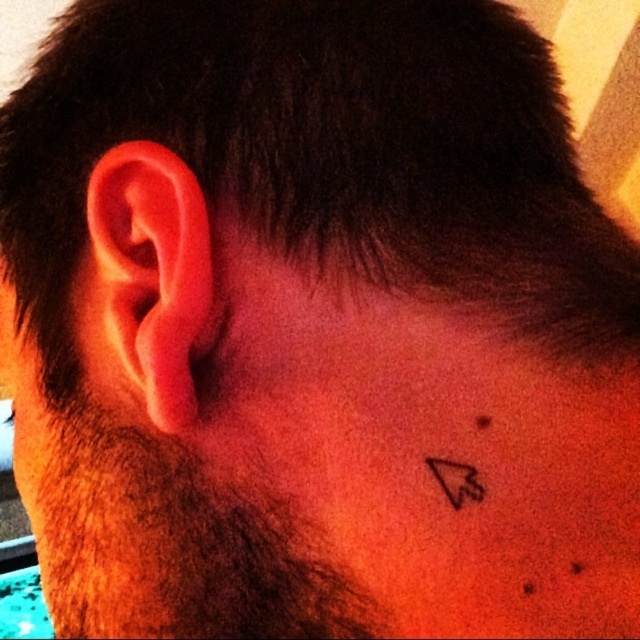
Question: Is pink flesh-colored ear at left smaller than black ink tattoo at lower center?

Choices:
 (A) no
 (B) yes

Answer: (A)

Question: Is pink flesh-colored ear at left thinner than black ink tattoo at lower center?

Choices:
 (A) no
 (B) yes

Answer: (A)

Question: Can you confirm if pink flesh-colored ear at left is thinner than black ink tattoo at lower center?

Choices:
 (A) no
 (B) yes

Answer: (A)

Question: Among these objects, which one is nearest to the camera?

Choices:
 (A) black ink tattoo at lower center
 (B) pink flesh-colored ear at left

Answer: (A)

Question: Which object is closer to the camera taking this photo?

Choices:
 (A) pink flesh-colored ear at left
 (B) black ink tattoo at lower center

Answer: (B)